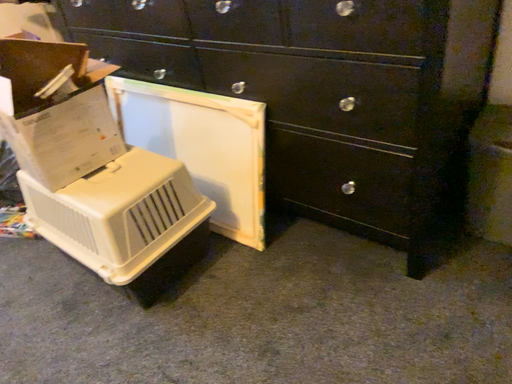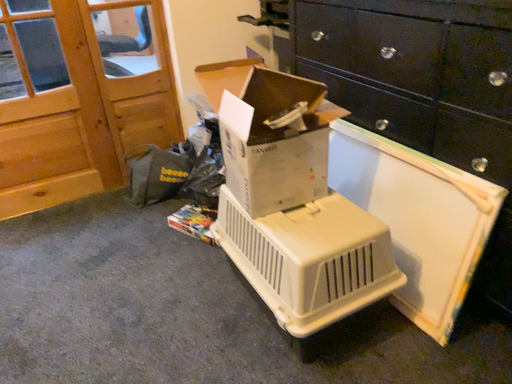
Question: How did the camera likely rotate when shooting the video?

Choices:
 (A) rotated left
 (B) rotated right

Answer: (A)